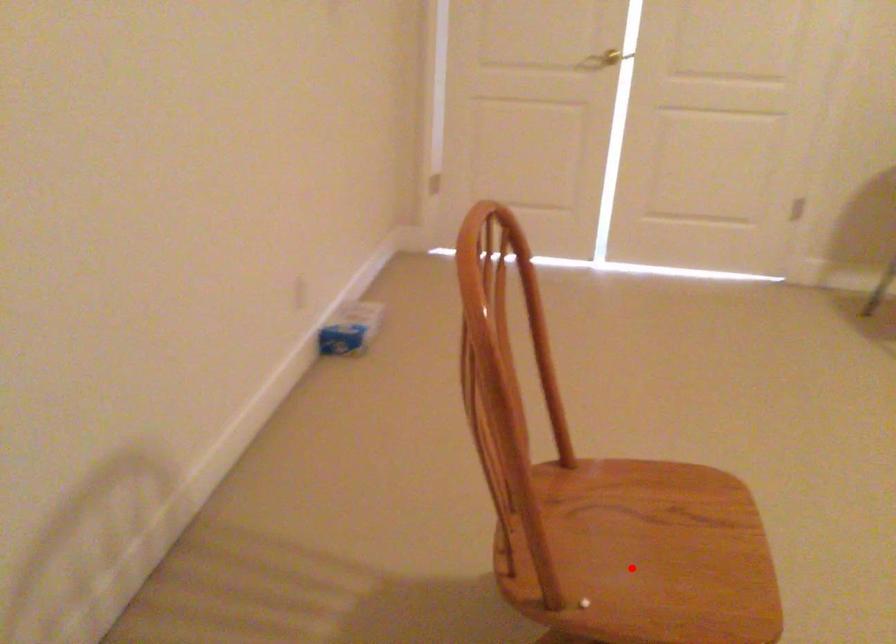
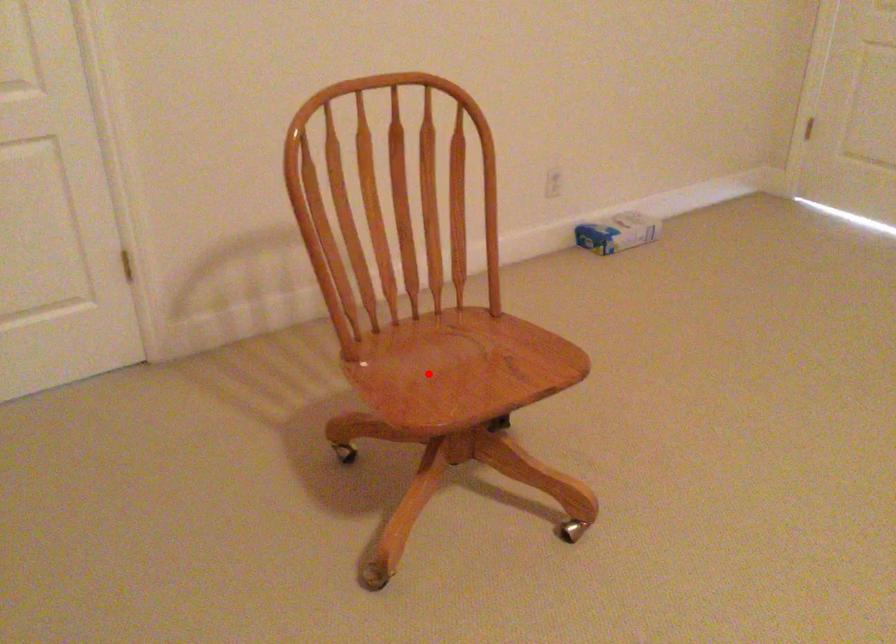
I am providing you with two images of the same scene from different viewpoints. A red point is marked on the first image and another point is marked on the second image. Do the highlighted points in image1 and image2 indicate the same real-world spot?

Yes